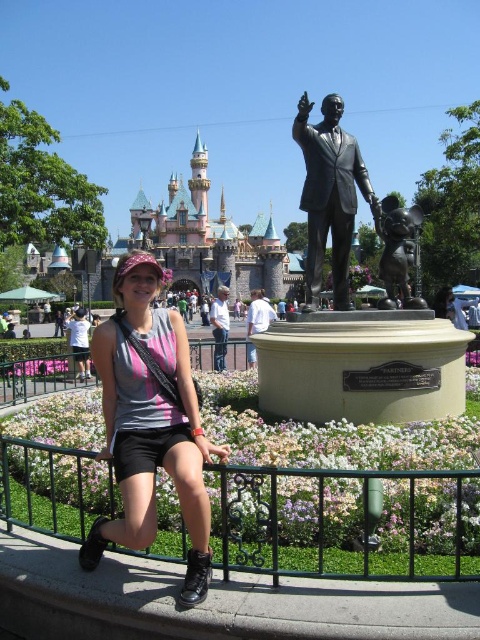
Question: Is green metal fence at lower center above bronze mickey mouse statue at center?

Choices:
 (A) yes
 (B) no

Answer: (B)

Question: Which object appears closest to the camera in this image?

Choices:
 (A) green metal fence at lower center
 (B) pink stone castle at upper center
 (C) bronze mickey mouse statue at center
 (D) pink fabric shirt at center

Answer: (A)

Question: Does bronze mickey mouse statue at center appear on the left side of pink fabric shirt at center?

Choices:
 (A) yes
 (B) no

Answer: (B)

Question: Among these points, which one is farthest from the camera?

Choices:
 (A) (346, 132)
 (B) (414, 208)

Answer: (B)

Question: Which object is closer to the camera taking this photo?

Choices:
 (A) bronze statue at center
 (B) pink stone castle at upper center
 (C) green metal fence at lower center

Answer: (C)

Question: Is pink stone castle at upper center behind bronze statue at center?

Choices:
 (A) no
 (B) yes

Answer: (B)